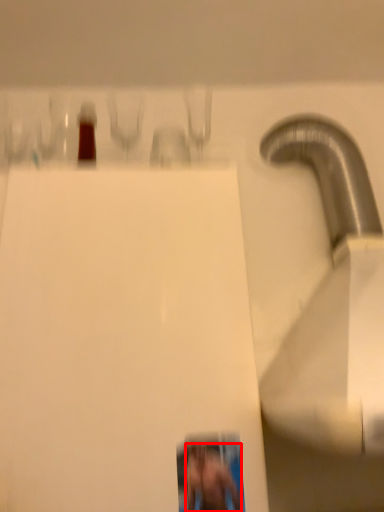
Question: From the image's perspective, considering the relative positions of person (annotated by the red box) and wide in the image provided, where is person (annotated by the red box) located with respect to the staircase?

Choices:
 (A) below
 (B) above

Answer: (A)